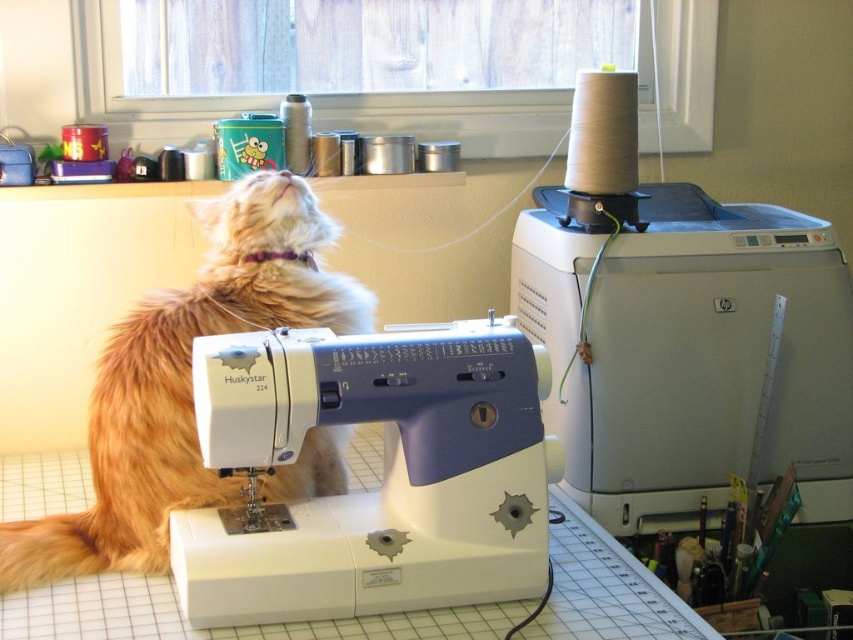
Between point (560, 246) and point (445, 362), which one is positioned behind?

The point (560, 246) is more distant.

Could you measure the distance between white plastic sewing machine at upper right and white plastic sewing machine at center?

They are 17.60 inches apart.

What do you see at coordinates (682, 332) in the screenshot? I see `white plastic sewing machine at upper right` at bounding box center [682, 332].

Image resolution: width=853 pixels, height=640 pixels. Identify the location of white plastic sewing machine at upper right. (682, 332).

Who is positioned more to the left, white plastic sewing machine at upper right or fluffy orange cat at center?

fluffy orange cat at center is more to the left.

In the scene shown: Is white plastic sewing machine at upper right wider than fluffy orange cat at center?

Yes, white plastic sewing machine at upper right is wider than fluffy orange cat at center.

Who is more distant from viewer, (848, 349) or (167, 305)?

Positioned behind is point (848, 349).

Where is `white plastic sewing machine at upper right`? The height and width of the screenshot is (640, 853). white plastic sewing machine at upper right is located at coordinates (682, 332).

From the picture: Does white plastic sewing machine at center have a lesser width compared to fluffy orange cat at center?

Incorrect, white plastic sewing machine at center's width is not less than fluffy orange cat at center's.

Between white plastic sewing machine at center and fluffy orange cat at center, which one is positioned higher?

fluffy orange cat at center is higher up.

Consider the image. Who is more distant from viewer, [230,384] or [109,552]?

The point [109,552] is more distant.

Locate an element on the screen. Image resolution: width=853 pixels, height=640 pixels. white plastic sewing machine at center is located at coordinates (384, 474).